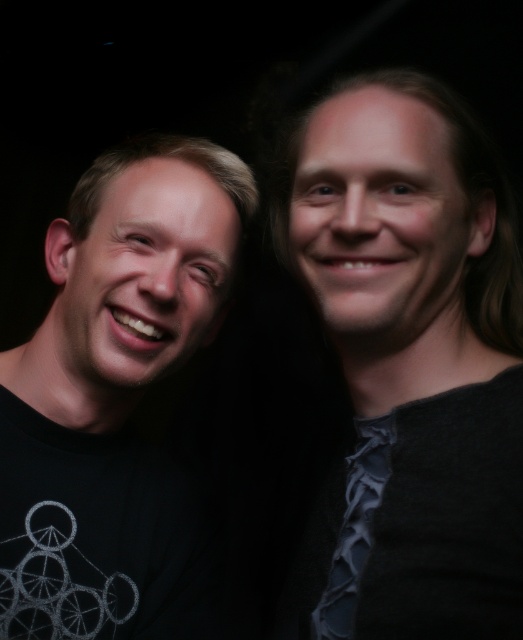
Who is positioned more to the right, gray wool sweater at upper right or dark blue textured tie at right?

From the viewer's perspective, gray wool sweater at upper right appears more on the right side.

Does gray wool sweater at upper right have a lesser width compared to dark blue textured tie at right?

Incorrect, gray wool sweater at upper right's width is not less than dark blue textured tie at right's.

Which is in front, point (313, 292) or point (377, 461)?

Point (313, 292)

Locate an element on the screen. The height and width of the screenshot is (640, 523). gray wool sweater at upper right is located at coordinates (410, 365).

Who is more distant from viewer, (197, 550) or (363, 499)?

The point (197, 550) is more distant.

Is black matte t-shirt at left behind dark blue textured tie at right?

That is True.

Who is more distant from viewer, (119, 419) or (369, 524)?

Positioned behind is point (119, 419).

At what (x,y) coordinates should I click in order to perform the action: click on black matte t-shirt at left. Please return your answer as a coordinate pair (x, y). Looking at the image, I should click on (115, 396).

Who is shorter, gray wool sweater at upper right or black matte t-shirt at left?

black matte t-shirt at left

Which is behind, point (504, 360) or point (77, 349)?

Positioned behind is point (77, 349).

In order to click on gray wool sweater at upper right in this screenshot , I will do `click(410, 365)`.